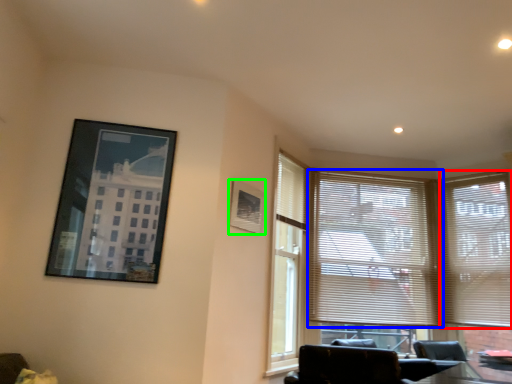
Question: Which is nearer to the window blind (highlighted by a red box)? window blind (highlighted by a blue box) or picture frame (highlighted by a green box).

Choices:
 (A) window blind
 (B) picture frame

Answer: (A)